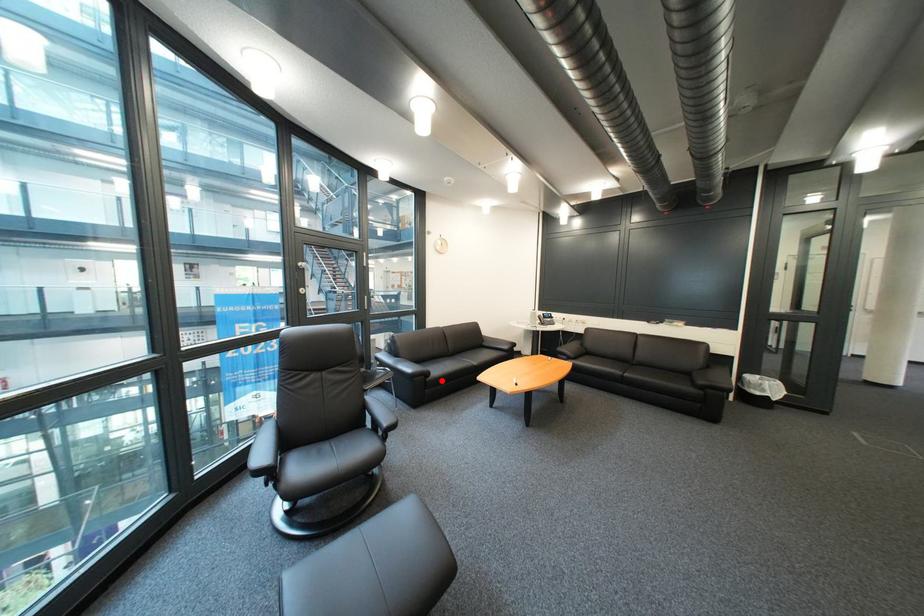
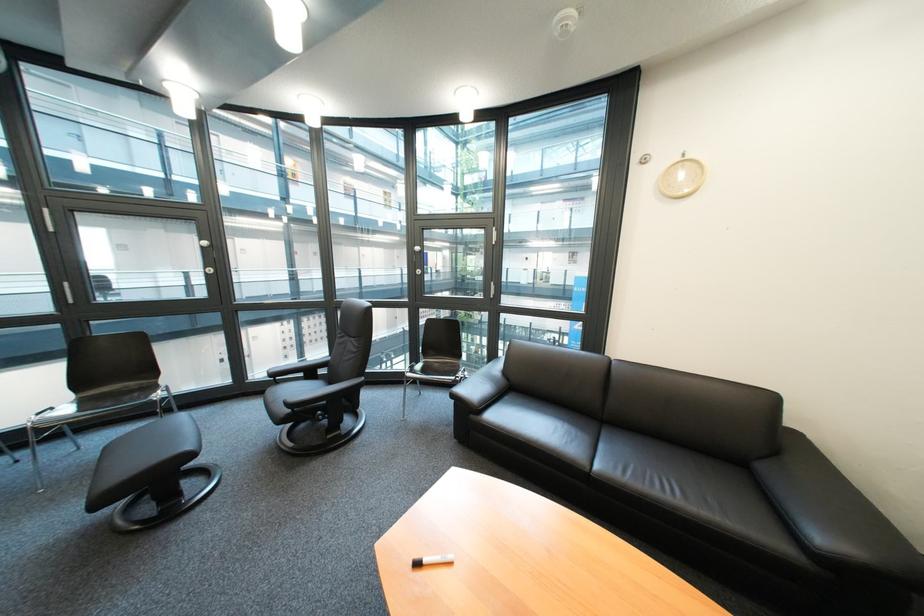
Where in the second image is the point corresponding to the highlighted location from the first image?

(485, 418)